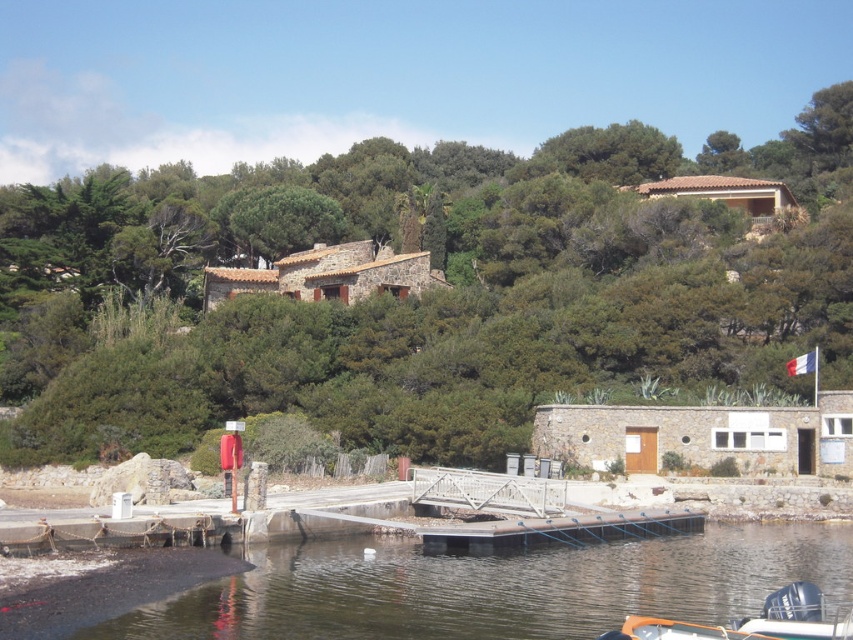
Question: Among these objects, which one is farthest from the camera?

Choices:
 (A) clear water at lower center
 (B) orange plastic boat at lower right

Answer: (A)

Question: Is clear water at lower center wider than orange plastic boat at lower right?

Choices:
 (A) no
 (B) yes

Answer: (B)

Question: Does clear water at lower center appear on the left side of orange plastic boat at lower right?

Choices:
 (A) no
 (B) yes

Answer: (B)

Question: Does clear water at lower center lie behind orange plastic boat at lower right?

Choices:
 (A) yes
 (B) no

Answer: (A)

Question: Which of the following is the closest to the observer?

Choices:
 (A) clear water at lower center
 (B) orange plastic boat at lower right

Answer: (B)